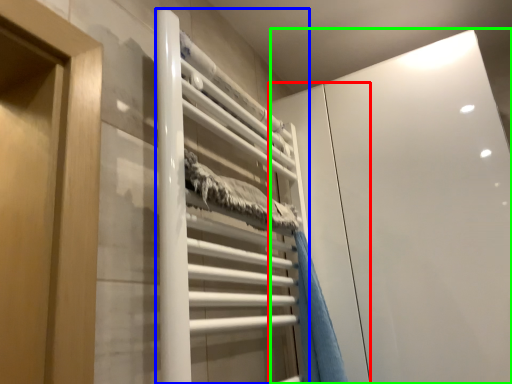
Question: Which is farther away from screen door (highlighted by a red box)? stair (highlighted by a blue box) or glass door (highlighted by a green box)?

Choices:
 (A) stair
 (B) glass door

Answer: (A)